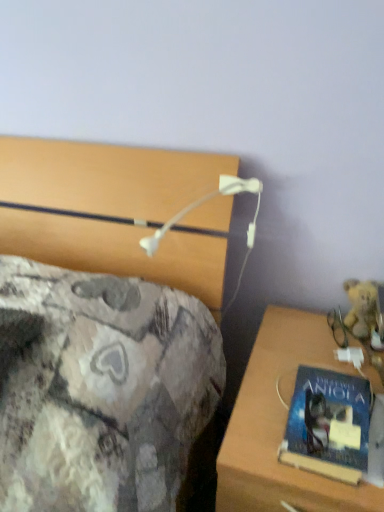
The width and height of the screenshot is (384, 512). I want to click on vacant space that is to the left of blue matte book at right, so click(258, 429).